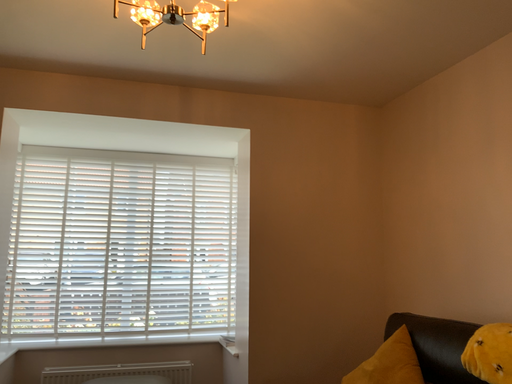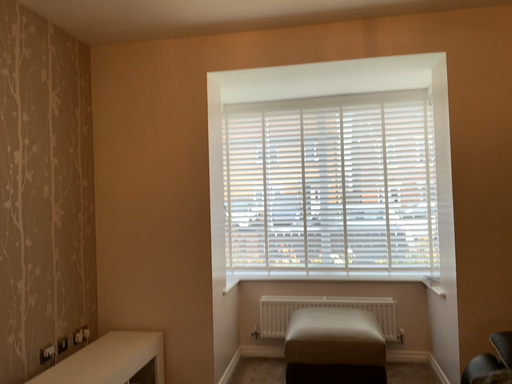
Question: Which way did the camera rotate in the video?

Choices:
 (A) rotated upward
 (B) rotated downward

Answer: (B)